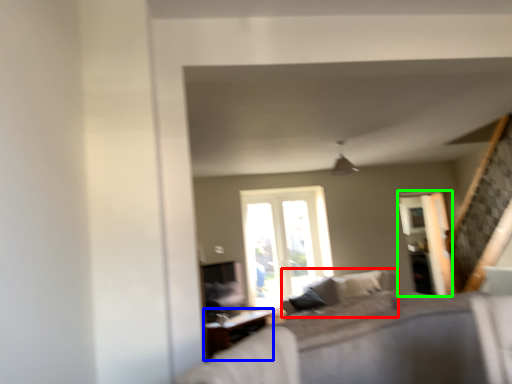
Question: Based on their relative distances, which object is farther from couch (highlighted by a red box)? Choose from table (highlighted by a blue box) and screen door (highlighted by a green box).

Choices:
 (A) table
 (B) screen door

Answer: (A)